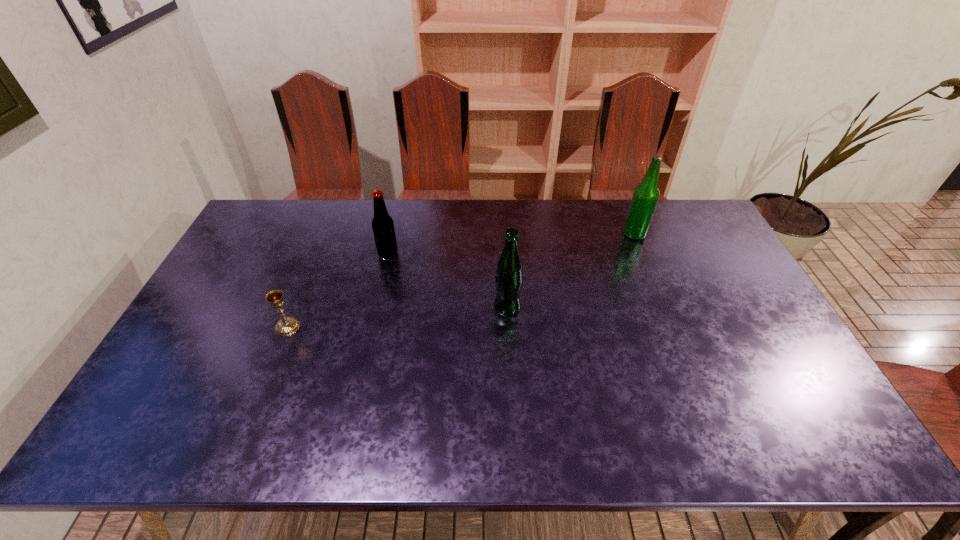
Identify which object is the third nearest to the chalice. Please provide its 2D coordinates. Your answer should be formatted as a tuple, i.e. [(x, y)], where the tuple contains the x and y coordinates of a point satisfying the conditions above.

[(646, 195)]

Select which object appears as the second closest to the shortest object. Please provide its 2D coordinates. Your answer should be formatted as a tuple, i.e. [(x, y)], where the tuple contains the x and y coordinates of a point satisfying the conditions above.

[(509, 276)]

Identify which beer bottle is the nearest to the shortest beer bottle. Please provide its 2D coordinates. Your answer should be formatted as a tuple, i.e. [(x, y)], where the tuple contains the x and y coordinates of a point satisfying the conditions above.

[(509, 276)]

Find the location of `beer bottle that is the second closest one to the second farthest beer bottle`. beer bottle that is the second closest one to the second farthest beer bottle is located at coordinates (646, 195).

Where is `vacant point that satisfies the following two spatial constraints: 1. on the label of the rightmost beer bottle; 2. on the front side of the shortest beer bottle`? This screenshot has height=540, width=960. vacant point that satisfies the following two spatial constraints: 1. on the label of the rightmost beer bottle; 2. on the front side of the shortest beer bottle is located at coordinates (642, 254).

Locate an element on the screen. The width and height of the screenshot is (960, 540). blank space that satisfies the following two spatial constraints: 1. on the back side of the leftmost object; 2. on the left side of the shortest beer bottle is located at coordinates (317, 254).